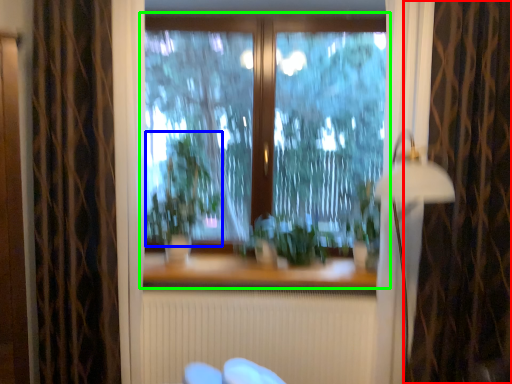
Question: Considering the real-world distances, which object is farthest from curtain (highlighted by a red box)? plant (highlighted by a blue box) or window (highlighted by a green box)?

Choices:
 (A) plant
 (B) window

Answer: (A)